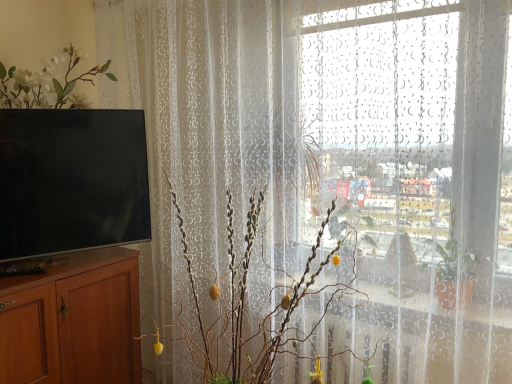
The height and width of the screenshot is (384, 512). What do you see at coordinates (246, 301) in the screenshot?
I see `silvery metallic branches at center` at bounding box center [246, 301].

In order to face silvery metallic branches at center, should I rotate leftwards or rightwards?

You should rotate left by 1.910 degrees.

I want to click on brown wood cabinet at left, so click(x=73, y=321).

Find the location of `matte black tv at left`. matte black tv at left is located at coordinates 72,180.

In the scene shown: Is silvery metallic branches at center beside matte black tv at left?

silvery metallic branches at center and matte black tv at left are not in contact.

Based on the photo, could matte black tv at left be considered to be inside silvery metallic branches at center?

Actually, matte black tv at left is outside silvery metallic branches at center.

How different are the orientations of silvery metallic branches at center and matte black tv at left in degrees?

The angle between the facing direction of silvery metallic branches at center and the facing direction of matte black tv at left is 61.7 degrees.

Considering the points (147, 335) and (113, 145), which point is behind, point (147, 335) or point (113, 145)?

The point (147, 335) is more distant.

Between matte black tv at left and brown wood cabinet at left, which one appears on the right side from the viewer's perspective?

matte black tv at left.

You are a GUI agent. You are given a task and a screenshot of the screen. Output one action in this format:
    pyautogui.click(x=<x>, y=<y>)
    Task: Click on the cabinetry in front of the matte black tv at left
    
    Given the screenshot: What is the action you would take?
    pos(73,321)

Would you say matte black tv at left is inside or outside brown wood cabinet at left?

matte black tv at left is not enclosed by brown wood cabinet at left.

From a real-world perspective, which object rests below the other?

In real-world perspective, brown wood cabinet at left is lower.

Is silvery metallic branches at center inside the boundaries of brown wood cabinet at left, or outside?

silvery metallic branches at center lies outside brown wood cabinet at left.

Is silvery metallic branches at center wider or thinner than brown wood cabinet at left?

In the image, silvery metallic branches at center appears to be more narrow than brown wood cabinet at left.

Does silvery metallic branches at center turn towards brown wood cabinet at left?

No.

Is brown wood cabinet at left with matte black tv at left?

brown wood cabinet at left is not next to matte black tv at left, and they're not touching.

Between brown wood cabinet at left and matte black tv at left, which one has smaller width?

Thinner between the two is matte black tv at left.

Is matte black tv at left at the back of brown wood cabinet at left?

brown wood cabinet at left does not have its back to matte black tv at left.

Can you confirm if brown wood cabinet at left is positioned to the left of matte black tv at left?

Yes, brown wood cabinet at left is to the left of matte black tv at left.

Considering their positions, is matte black tv at left located in front of or behind silvery metallic branches at center?

Clearly, matte black tv at left is behind silvery metallic branches at center.

From a real-world perspective, is matte black tv at left above or below silvery metallic branches at center?

matte black tv at left is situated higher than silvery metallic branches at center in the real world.

Who is taller, matte black tv at left or silvery metallic branches at center?

silvery metallic branches at center is taller.

Does matte black tv at left touch silvery metallic branches at center?

No, matte black tv at left is not beside silvery metallic branches at center.

From the image's perspective, is brown wood cabinet at left located above or below silvery metallic branches at center?

Based on their image positions, brown wood cabinet at left is located beneath silvery metallic branches at center.

From a real-world perspective, is brown wood cabinet at left physically above silvery metallic branches at center?

Actually, brown wood cabinet at left is physically below silvery metallic branches at center in the real world.

Is brown wood cabinet at left not within silvery metallic branches at center?

Indeed, brown wood cabinet at left is completely outside silvery metallic branches at center.

Which object is more forward, brown wood cabinet at left or silvery metallic branches at center?

silvery metallic branches at center is more forward.

At what (x,y) coordinates should I click in order to perform the action: click on television above the silvery metallic branches at center (from a real-world perspective). Please return your answer as a coordinate pair (x, y). Looking at the image, I should click on (72, 180).

Where is `cabinetry in front of the matte black tv at left`? cabinetry in front of the matte black tv at left is located at coordinates (73, 321).

Based on their spatial positions, is brown wood cabinet at left or silvery metallic branches at center further from matte black tv at left?

silvery metallic branches at center lies further to matte black tv at left than the other object.

When comparing their distances from matte black tv at left, does silvery metallic branches at center or brown wood cabinet at left seem closer?

brown wood cabinet at left is closer to matte black tv at left.

Looking at the image, which one is located closer to brown wood cabinet at left, matte black tv at left or silvery metallic branches at center?

matte black tv at left lies closer to brown wood cabinet at left than the other object.

Which object lies further to the anchor point silvery metallic branches at center, matte black tv at left or brown wood cabinet at left?

brown wood cabinet at left is positioned further to the anchor silvery metallic branches at center.

Based on their spatial positions, is brown wood cabinet at left or matte black tv at left further from silvery metallic branches at center?

brown wood cabinet at left lies further to silvery metallic branches at center than the other object.

Which object lies nearer to the anchor point brown wood cabinet at left, silvery metallic branches at center or matte black tv at left?

The object closer to brown wood cabinet at left is matte black tv at left.

Find the location of a particular element. This screenshot has width=512, height=384. television between brown wood cabinet at left and silvery metallic branches at center from left to right is located at coordinates (72, 180).